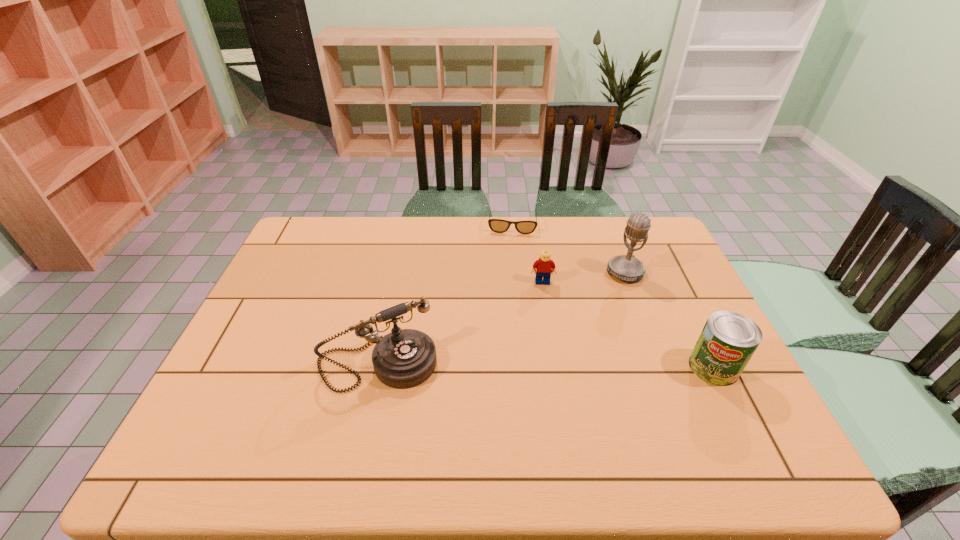
Identify the location of free spot between the sunglasses and the fourth tallest object. The height and width of the screenshot is (540, 960). click(527, 254).

Locate an element on the screen. free spot between the telephone and the rightmost object is located at coordinates (545, 366).

Identify the location of unoccupied position between the rightmost object and the telephone. The height and width of the screenshot is (540, 960). (545, 366).

Image resolution: width=960 pixels, height=540 pixels. Find the location of `vacant region between the rightmost object and the second object from right to left`. vacant region between the rightmost object and the second object from right to left is located at coordinates (669, 320).

This screenshot has height=540, width=960. Identify the location of free space that is in between the farthest object and the leftmost object. (444, 295).

Image resolution: width=960 pixels, height=540 pixels. Identify the location of vacant region between the sunglasses and the leftmost object. (444, 295).

Locate an element on the screen. This screenshot has width=960, height=540. free space between the shortest object and the can is located at coordinates [612, 296].

Where is `vacant space that is in between the Lego and the leftmost object`? vacant space that is in between the Lego and the leftmost object is located at coordinates (460, 323).

Find the location of `object that stands as the second closest to the sunglasses`. object that stands as the second closest to the sunglasses is located at coordinates (628, 268).

Identify which object is the second closest to the second object from right to left. Please provide its 2D coordinates. Your answer should be formatted as a tuple, i.e. [(x, y)], where the tuple contains the x and y coordinates of a point satisfying the conditions above.

[(496, 225)]